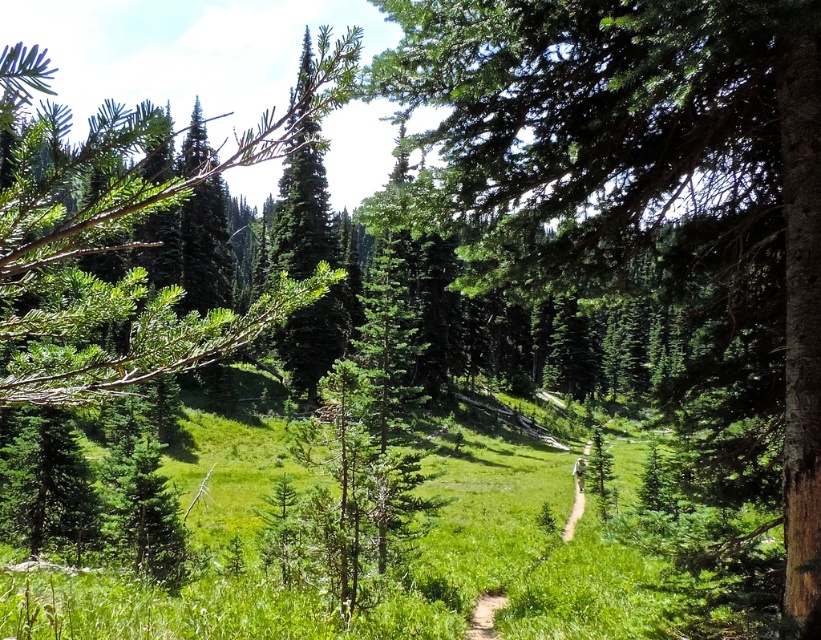
Which of these two, green textured tree at center or green needle-like leaves at center, stands taller?

green needle-like leaves at center is taller.

Can you confirm if green textured tree at center is bigger than green needle-like leaves at center?

No.

At what (x,y) coordinates should I click in order to perform the action: click on green textured tree at center. Please return your answer as a coordinate pair (x, y). Looking at the image, I should click on (641, 173).